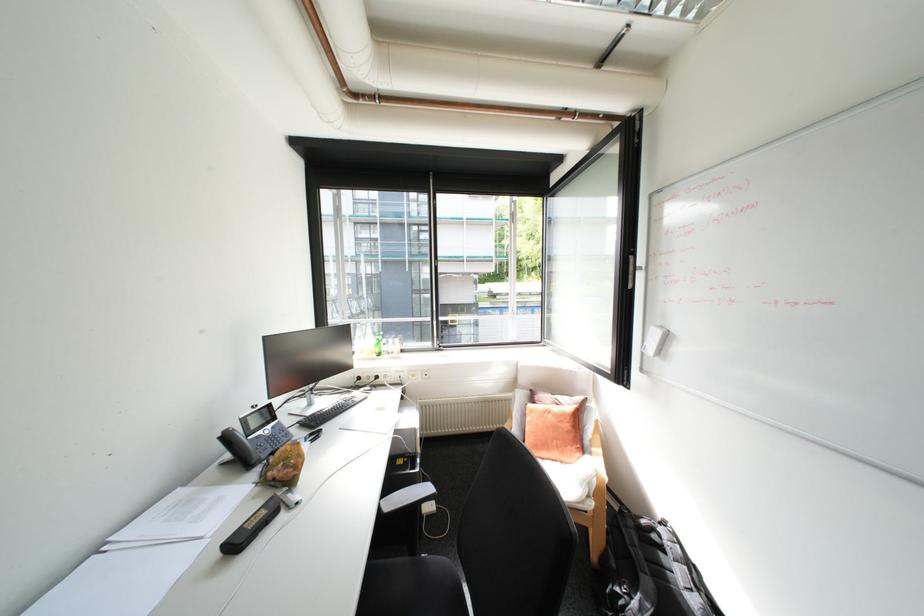
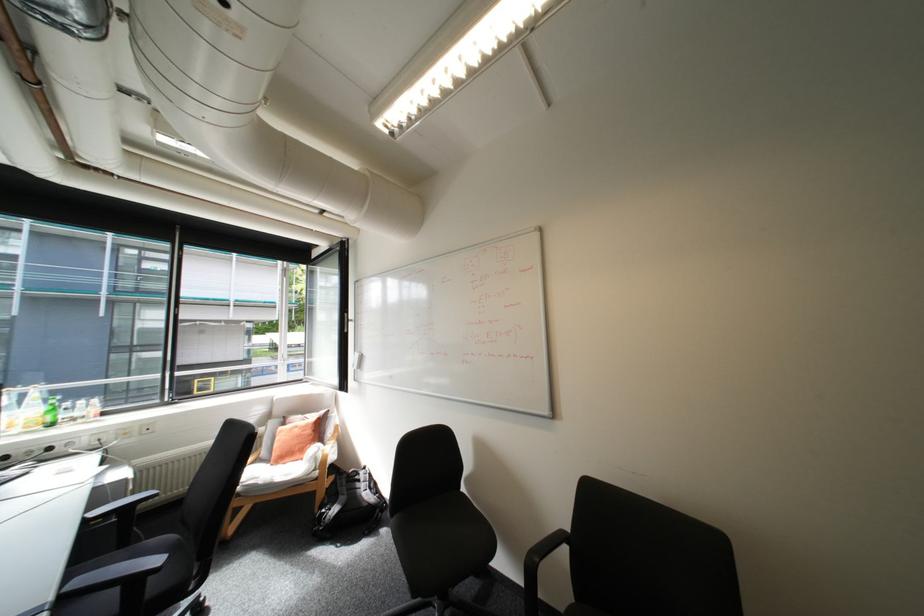
Where in the second image is the point corresponding to point (383, 342) from the first image?

(55, 408)